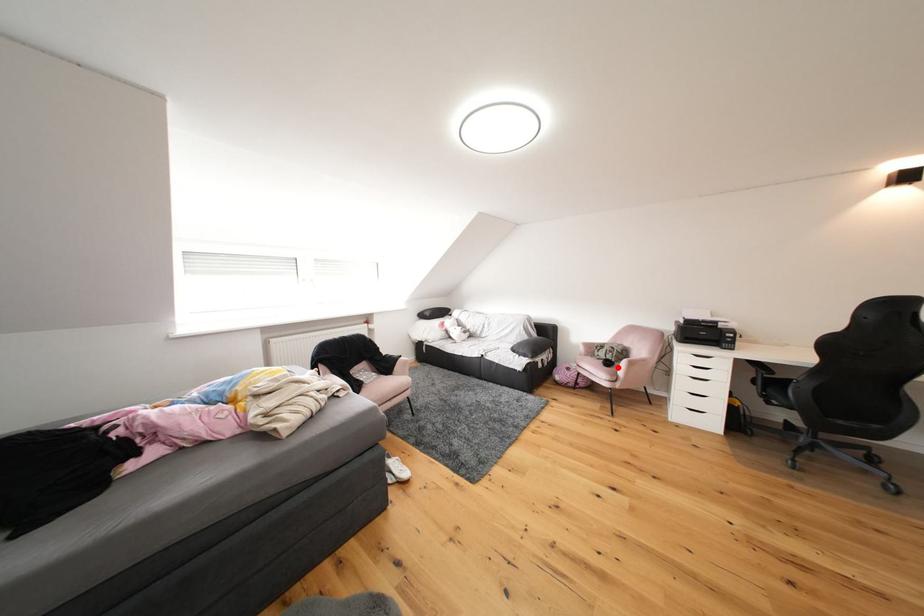
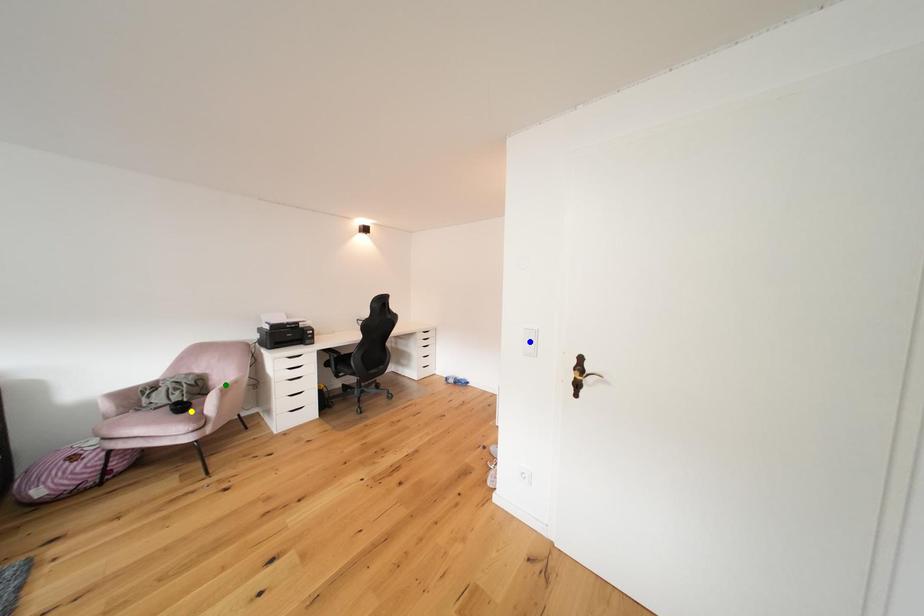
Question: I am providing you with two images of the same scene from different viewpoints. A red point is marked on the first image. You are given multiple points on the second image. In image 2, which mark is for the same physical point as the one in image 1?

Choices:
 (A) blue point
 (B) yellow point
 (C) green point

Answer: (B)